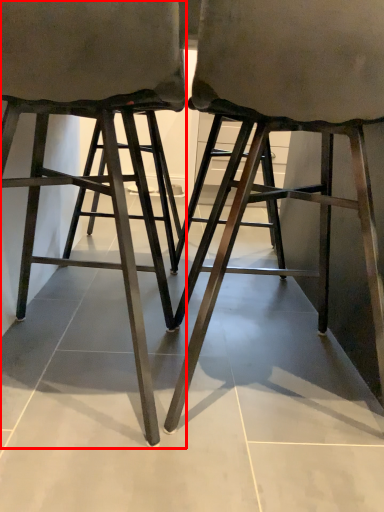
Question: From the image's perspective, what is the correct spatial relationship of stool (annotated by the red box) in relation to stool?

Choices:
 (A) above
 (B) below

Answer: (A)